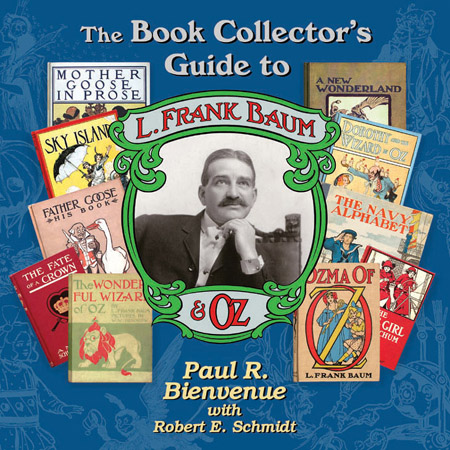
This screenshot has width=450, height=450. I want to click on book, so [91, 93], [84, 144], [90, 240], [51, 272], [90, 304], [325, 321], [409, 281], [403, 241], [378, 170], [372, 94].